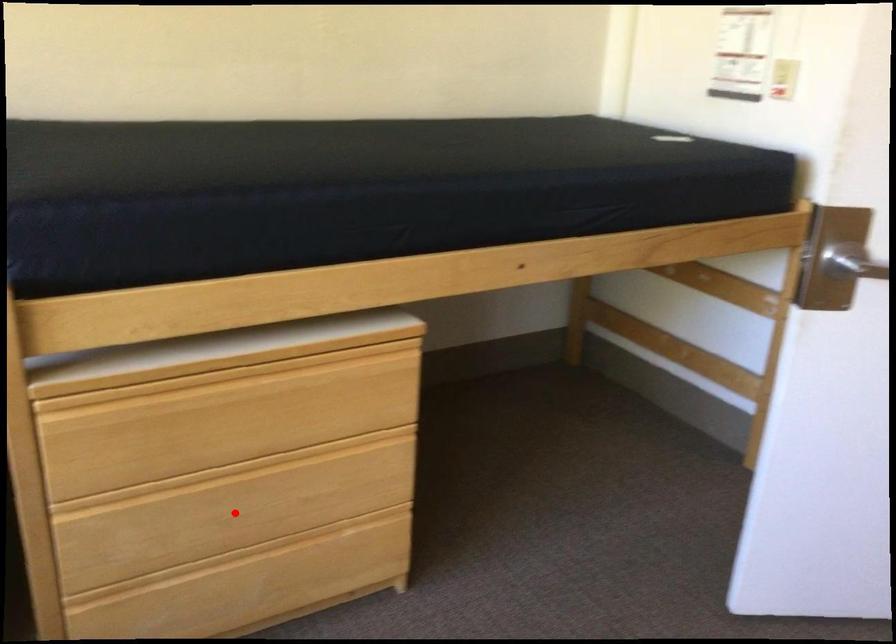
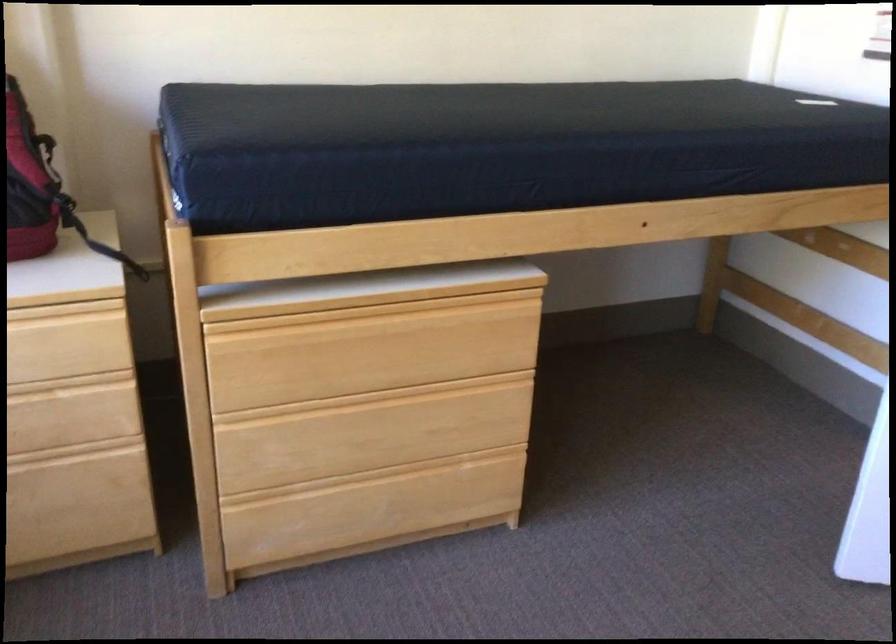
Where in the second image is the point corresponding to the highlighted location from the first image?

(371, 433)